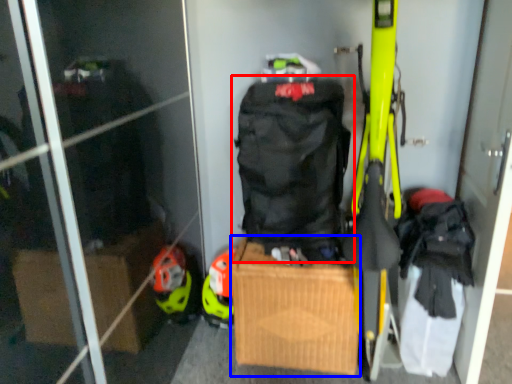
Question: Among these objects, which one is nearest to the camera, backpack (highlighted by a red box) or cardboard box (highlighted by a blue box)?

Choices:
 (A) backpack
 (B) cardboard box

Answer: (A)